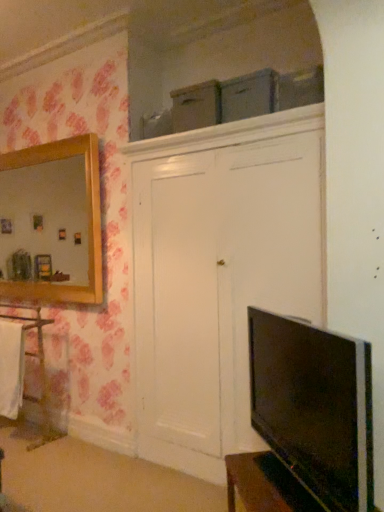
Question: Is black glossy tv at lower right wider than white fabric towel at left?

Choices:
 (A) no
 (B) yes

Answer: (B)

Question: From the image's perspective, is black glossy tv at lower right above white fabric towel at left?

Choices:
 (A) no
 (B) yes

Answer: (B)

Question: Is the depth of black glossy tv at lower right less than that of white fabric towel at left?

Choices:
 (A) yes
 (B) no

Answer: (A)

Question: Is black glossy tv at lower right aimed at white fabric towel at left?

Choices:
 (A) no
 (B) yes

Answer: (A)

Question: Is white fabric towel at left a part of black glossy tv at lower right?

Choices:
 (A) no
 (B) yes

Answer: (A)

Question: Can you confirm if black glossy tv at lower right is taller than white fabric towel at left?

Choices:
 (A) yes
 (B) no

Answer: (B)

Question: From a real-world perspective, is white fabric towel at left physically below white wood cabinet at left?

Choices:
 (A) yes
 (B) no

Answer: (B)

Question: Does white fabric towel at left have a lesser width compared to white wood cabinet at left?

Choices:
 (A) yes
 (B) no

Answer: (A)

Question: Is white fabric towel at left positioned beyond the bounds of white wood cabinet at left?

Choices:
 (A) yes
 (B) no

Answer: (B)

Question: Does white fabric towel at left contain white wood cabinet at left?

Choices:
 (A) no
 (B) yes

Answer: (A)

Question: Is white fabric towel at left bigger than white wood cabinet at left?

Choices:
 (A) yes
 (B) no

Answer: (B)

Question: Does white fabric towel at left lie behind white wood cabinet at left?

Choices:
 (A) yes
 (B) no

Answer: (B)

Question: From the image's perspective, is white wood cabinet at left under black glossy tv at lower right?

Choices:
 (A) yes
 (B) no

Answer: (A)